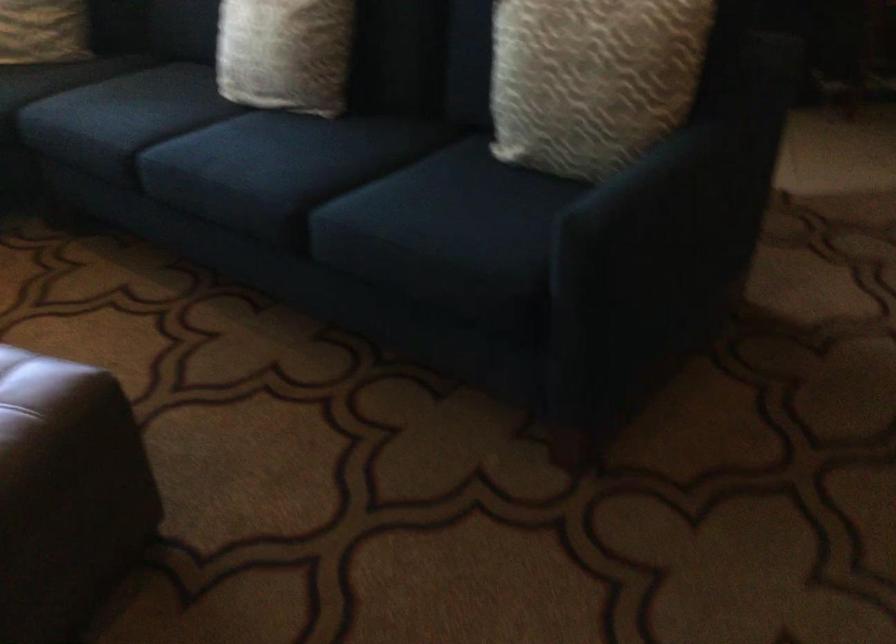
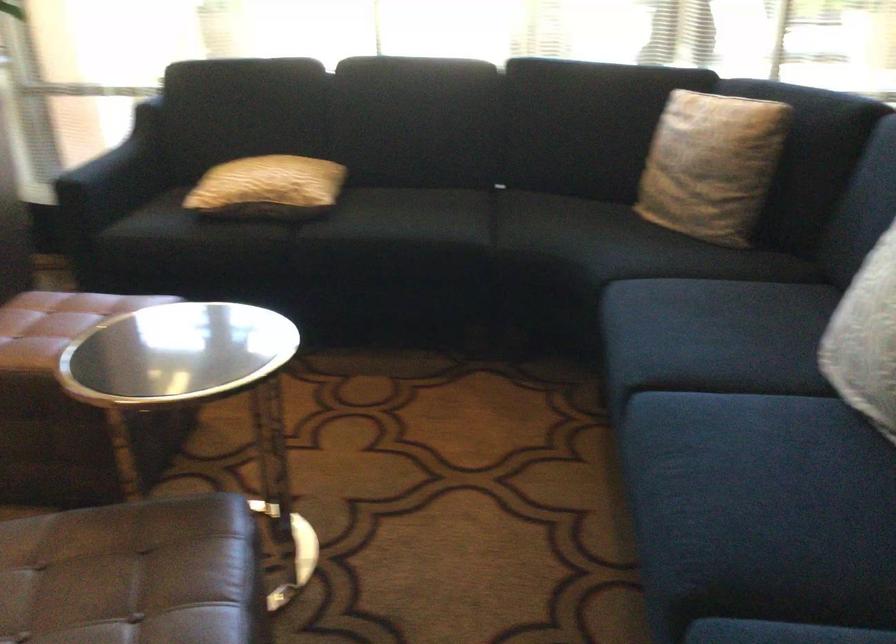
Question: The camera is either moving clockwise (left) or counter-clockwise (right) around the object. The first image is from the beginning of the video and the second image is from the end. Is the camera moving left or right when shooting the video?

Choices:
 (A) Left
 (B) Right

Answer: (B)